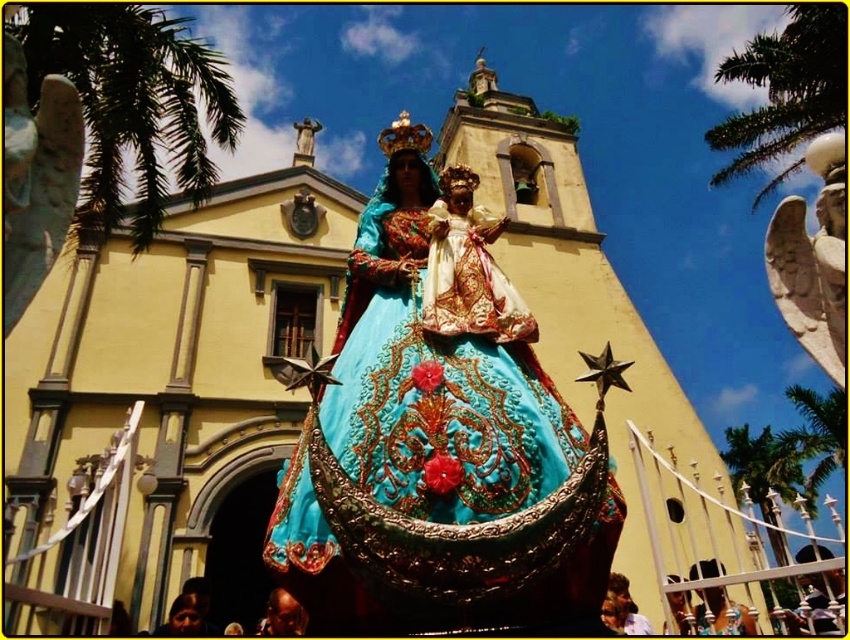
You are an architect designing a new garden layout for the church. You need to place a new statue that must be taller than both green leafy palm tree at left and green leafy palm tree at upper right. Given that the taller palm tree is 10 feet tall, what is the minimum height your statue should be?

The green leafy palm tree at upper right is taller than the green leafy palm tree at left. Since the taller palm tree is 10 feet tall, the statue must be at least 10 feet tall to meet the requirement.